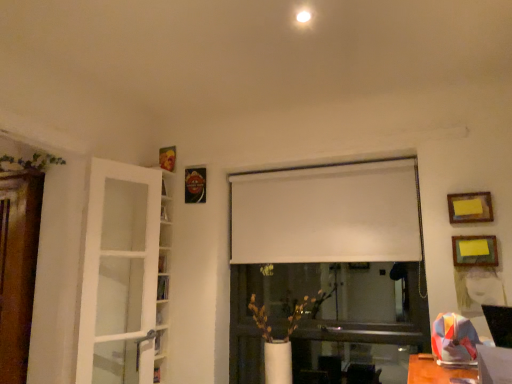
Question: Which direction should I rotate to look at white matte vase at center, arranged as the 2th plant when viewed from the top, — up or down?

Choices:
 (A) up
 (B) down

Answer: (B)

Question: Is white matte curtain at center in front of green leafy plant at upper left, which ranks as the first plant in left-to-right order?

Choices:
 (A) no
 (B) yes

Answer: (A)

Question: From a real-world perspective, is white matte curtain at center located beneath green leafy plant at upper left, which ranks as the first plant in left-to-right order?

Choices:
 (A) no
 (B) yes

Answer: (B)

Question: Are white matte curtain at center and green leafy plant at upper left, which is the 1th plant in top-to-bottom order, located far from each other?

Choices:
 (A) yes
 (B) no

Answer: (A)

Question: Is white matte curtain at center turned away from green leafy plant at upper left, acting as the second plant starting from the bottom?

Choices:
 (A) yes
 (B) no

Answer: (B)

Question: Can you confirm if white matte curtain at center is bigger than green leafy plant at upper left, which ranks as the first plant in left-to-right order?

Choices:
 (A) no
 (B) yes

Answer: (B)

Question: Can you confirm if white matte curtain at center is taller than green leafy plant at upper left, positioned as the second plant in right-to-left order?

Choices:
 (A) no
 (B) yes

Answer: (B)

Question: Is the position of white matte vase at center, which is the first plant in right-to-left order, less distant than that of white glass door at left?

Choices:
 (A) yes
 (B) no

Answer: (B)

Question: From the image's perspective, is white matte vase at center, marked as the second plant in a left-to-right arrangement, located above white glass door at left?

Choices:
 (A) no
 (B) yes

Answer: (A)

Question: From a real-world perspective, is white matte vase at center, marked as the second plant in a left-to-right arrangement, on white glass door at left?

Choices:
 (A) yes
 (B) no

Answer: (B)

Question: From a real-world perspective, does white matte vase at center, the first plant in the bottom-to-top sequence, sit lower than white glass door at left?

Choices:
 (A) yes
 (B) no

Answer: (A)

Question: Does white matte vase at center, arranged as the 2th plant when viewed from the top, appear on the right side of white glass door at left?

Choices:
 (A) no
 (B) yes

Answer: (B)

Question: Considering the relative sizes of white matte vase at center, which is the first plant in right-to-left order, and white glass door at left in the image provided, is white matte vase at center, which is the first plant in right-to-left order, smaller than white glass door at left?

Choices:
 (A) no
 (B) yes

Answer: (B)

Question: Would you say green leafy plant at upper left, which is the 1th plant in top-to-bottom order, is part of yellow paper at upper right, arranged as the 2th picture frame when viewed from the top,'s contents?

Choices:
 (A) yes
 (B) no

Answer: (B)